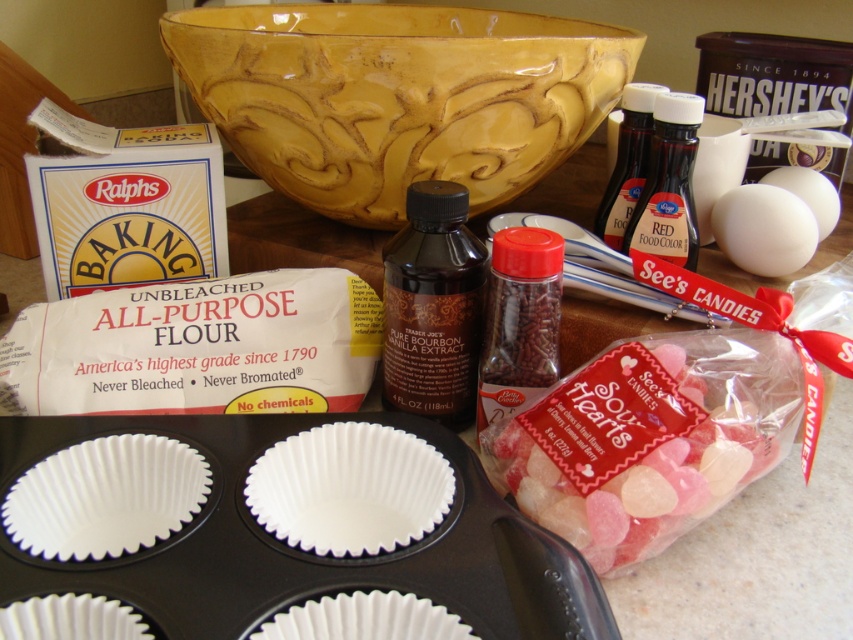
Question: Does pink translucent hearts at center right have a larger size compared to dark brown liquid at center?

Choices:
 (A) no
 (B) yes

Answer: (B)

Question: Does pink translucent hearts at center right appear on the right side of dark brown liquid at center?

Choices:
 (A) yes
 (B) no

Answer: (A)

Question: Which object is closer to the camera taking this photo?

Choices:
 (A) pink translucent hearts at center right
 (B) dark brown liquid at center

Answer: (A)

Question: Can you confirm if pink translucent hearts at center right is positioned above dark brown liquid at center?

Choices:
 (A) yes
 (B) no

Answer: (B)